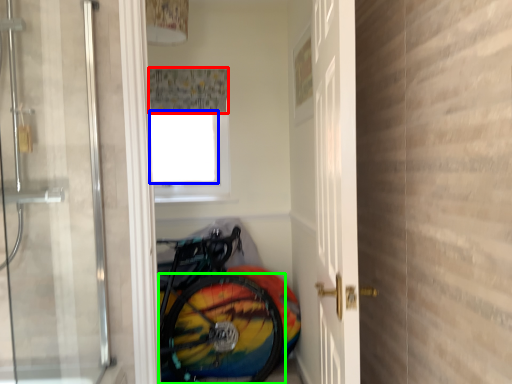
Question: Estimate the real-world distances between objects in this image. Which object is closer to shower curtain (highlighted by a red box), window screen (highlighted by a blue box) or bicycle wheel (highlighted by a green box)?

Choices:
 (A) window screen
 (B) bicycle wheel

Answer: (A)